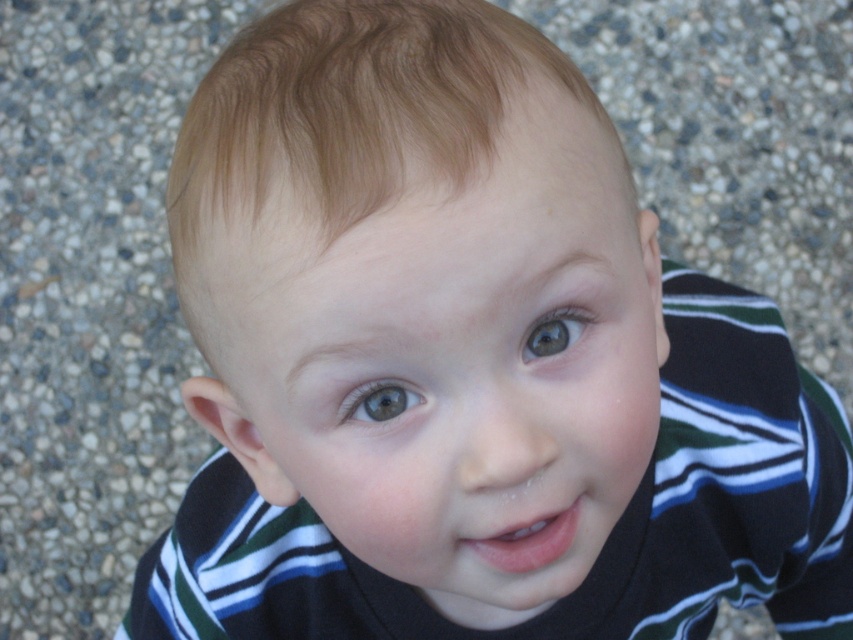
From the picture: Looking at the child in the image, which eye has a larger height between the green matte eye at center and the blue glossy eye at center?

The green matte eye at center is much taller than the blue glossy eye at center.

You are an artist trying to draw the child in the image. To accurately place the green matte eye at center, where should you position it on a canvas divided into a grid from 0 to 1 in both x and y axes?

The green matte eye at center should be positioned at the coordinates point (554, 332) on the canvas grid.

You are a photographer trying to capture a closeup of the child. The camera has a focus range that can only handle objects within 2 inches of each other. Can you focus on both the green matte eye at center and the blue glossy eye at center simultaneously?

The green matte eye at center and the blue glossy eye at center are 1.88 inches apart from each other, which is within the camera focus range of 2 inches. Therefore, the photographer can focus on both eyes simultaneously.